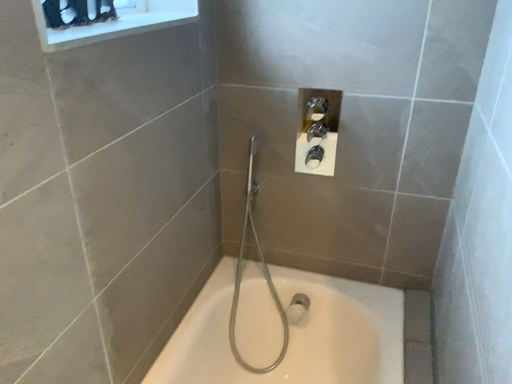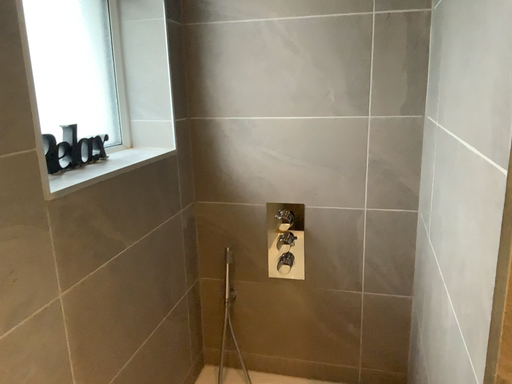
Question: How did the camera likely rotate when shooting the video?

Choices:
 (A) rotated upward
 (B) rotated downward

Answer: (A)